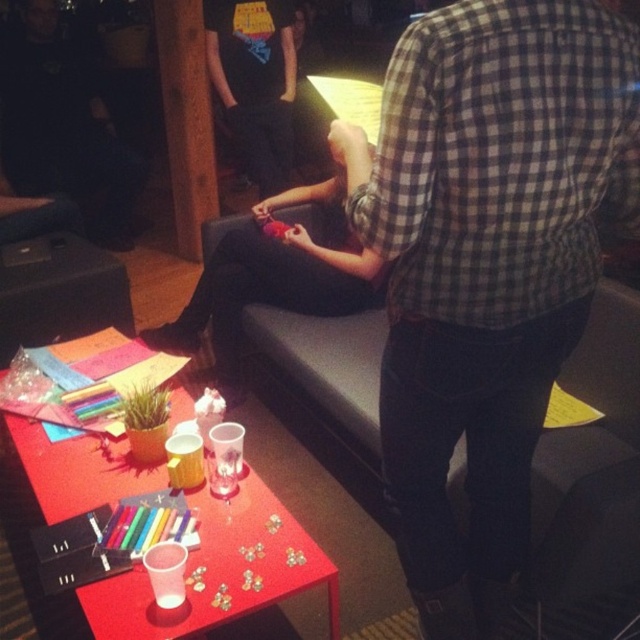
Question: Which of these objects is positioned farthest from the checkered fabric shirt at center?

Choices:
 (A) matte black shirt at upper center
 (B) translucent plastic table at center
 (C) wooden at center
 (D) matte black pants at center

Answer: (A)

Question: Which point appears closest to the camera in this image?

Choices:
 (A) (92, 209)
 (B) (353, 240)
 (C) (179, 88)

Answer: (B)

Question: Which object appears farthest from the camera in this image?

Choices:
 (A) wooden at center
 (B) matte black pants at center
 (C) translucent plastic table at center
 (D) checkered fabric shirt at center

Answer: (A)

Question: Can you confirm if translucent plastic table at center is bigger than matte black pants at center?

Choices:
 (A) yes
 (B) no

Answer: (B)

Question: Can you confirm if checkered fabric shirt at center is positioned above wooden at center?

Choices:
 (A) no
 (B) yes

Answer: (A)

Question: Does matte black shirt at upper center appear on the left side of matte black pants at center?

Choices:
 (A) no
 (B) yes

Answer: (B)